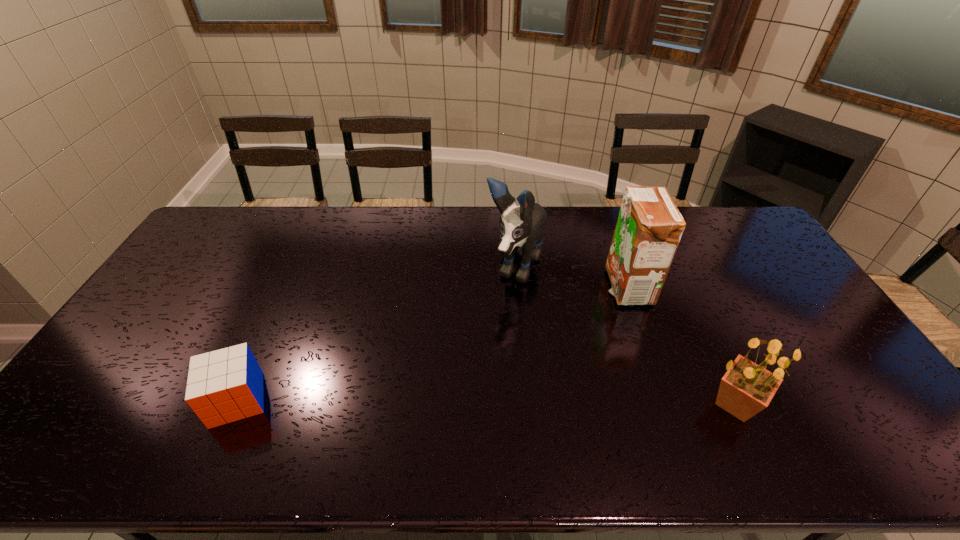
Where is `free area in between the carton and the sunflower`? free area in between the carton and the sunflower is located at coordinates (682, 346).

The image size is (960, 540). I want to click on vacant space that's between the carton and the shortest object, so click(432, 343).

Image resolution: width=960 pixels, height=540 pixels. In order to click on vacant space in between the sunflower and the second object from left to right in this screenshot , I will do click(x=625, y=336).

Where is `vacant point located between the puppy and the second tallest object`? vacant point located between the puppy and the second tallest object is located at coordinates (571, 278).

Locate which object ranks second in proximity to the second shortest object. Please provide its 2D coordinates. Your answer should be formatted as a tuple, i.e. [(x, y)], where the tuple contains the x and y coordinates of a point satisfying the conditions above.

[(521, 228)]

Image resolution: width=960 pixels, height=540 pixels. I want to click on the second closest object to the carton, so click(x=747, y=388).

What are the coordinates of `free space in the image that satisfies the following two spatial constraints: 1. on the front side of the sunflower; 2. at the front of the third shortest object with flowers visible` in the screenshot? It's located at (668, 404).

Where is `vacant region that satisfies the following two spatial constraints: 1. on the front side of the tallest object; 2. at the front of the sunflower with flowers visible`? vacant region that satisfies the following two spatial constraints: 1. on the front side of the tallest object; 2. at the front of the sunflower with flowers visible is located at coordinates (527, 404).

The width and height of the screenshot is (960, 540). Find the location of `free spot that satisfies the following two spatial constraints: 1. on the back side of the carton; 2. on the right side of the leftmost object`. free spot that satisfies the following two spatial constraints: 1. on the back side of the carton; 2. on the right side of the leftmost object is located at coordinates pos(288,287).

Identify the location of vacant space that satisfies the following two spatial constraints: 1. on the back side of the carton; 2. on the right side of the shortest object. (288, 287).